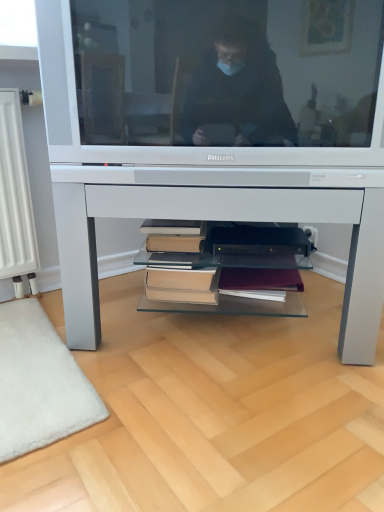
Question: Does point (183, 231) appear closer or farther from the camera than point (124, 49)?

Choices:
 (A) farther
 (B) closer

Answer: (A)

Question: From the image's perspective, is hardcover books at center above or below matte silver television at center?

Choices:
 (A) below
 (B) above

Answer: (A)

Question: Estimate the real-world distances between objects in this image. Which object is farther from the white glossy desk at center?

Choices:
 (A) hardcover books at center
 (B) matte silver television at center

Answer: (A)

Question: Which object is positioned farthest from the hardcover books at center?

Choices:
 (A) white glossy desk at center
 (B) matte silver television at center

Answer: (B)